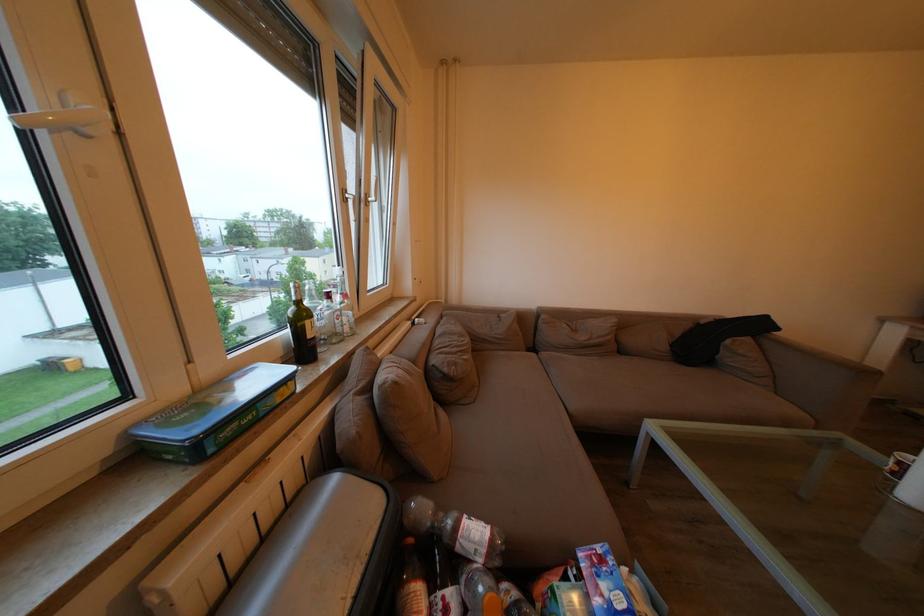
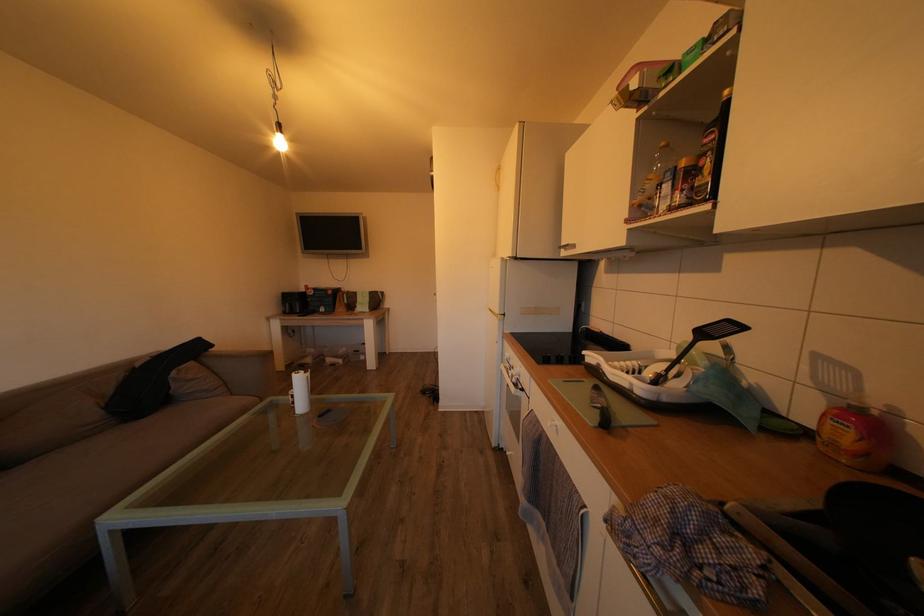
Question: Based on the continuous images, in which direction is the camera rotating? Reply with the corresponding letter.

Choices:
 (A) Left
 (B) Right
 (C) Up
 (D) Down

Answer: (B)